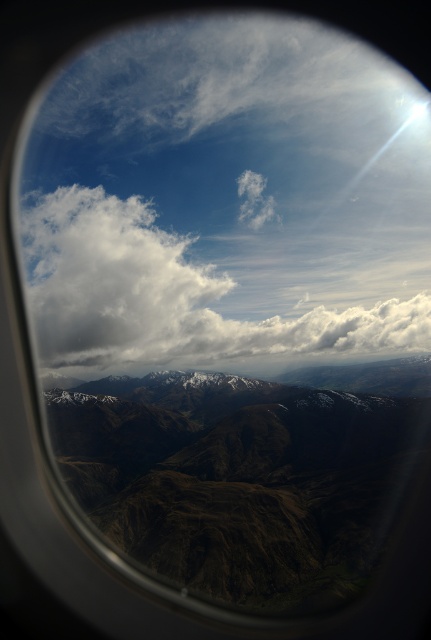
Question: Which object is farther from the camera taking this photo?

Choices:
 (A) brown textured mountain range at center
 (B) white fluffy cloud at upper center

Answer: (B)

Question: Does brown textured mountain range at center have a smaller size compared to white fluffy cloud at upper center?

Choices:
 (A) yes
 (B) no

Answer: (A)

Question: Does brown textured mountain range at center appear on the right side of white fluffy cloud at upper center?

Choices:
 (A) no
 (B) yes

Answer: (B)

Question: From the image, what is the correct spatial relationship of brown textured mountain range at center in relation to white fluffy cloud at upper center?

Choices:
 (A) below
 (B) above

Answer: (A)

Question: Which of the following is the closest to the observer?

Choices:
 (A) white fluffy cloud at upper center
 (B) brown textured mountain range at center

Answer: (B)